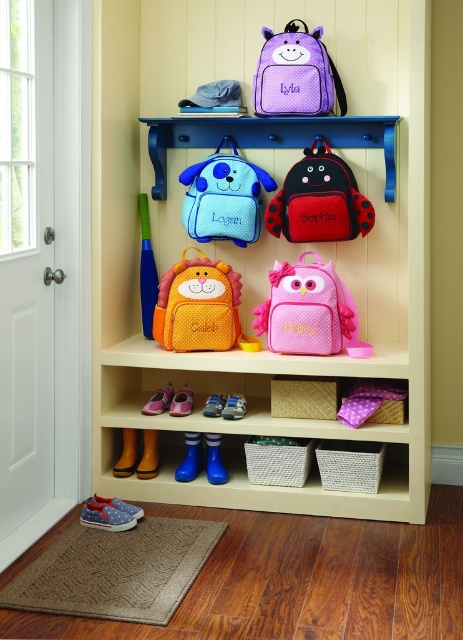
Does point (344, 227) come closer to viewer compared to point (148, 273)?

Yes, point (344, 227) is in front of point (148, 273).

Between red fabric backpack at center and blue rubber bat at upper left, which one is positioned higher?

Positioned higher is red fabric backpack at center.

Identify the location of red fabric backpack at center. (319, 200).

Can you confirm if red fabric backpack at center is wider than purple dotted backpack at upper center?

Correct, the width of red fabric backpack at center exceeds that of purple dotted backpack at upper center.

Does point (285, 182) come closer to viewer compared to point (345, 109)?

Yes.

Identify the location of red fabric backpack at center. The height and width of the screenshot is (640, 463). (319, 200).

From the picture: Is orange dotted backpack at center above purple dotted backpack at upper center?

No.

Based on the photo, can you confirm if orange dotted backpack at center is positioned below purple dotted backpack at upper center?

Indeed, orange dotted backpack at center is positioned under purple dotted backpack at upper center.

Where is `orange dotted backpack at center`? Image resolution: width=463 pixels, height=640 pixels. orange dotted backpack at center is located at coordinates (200, 307).